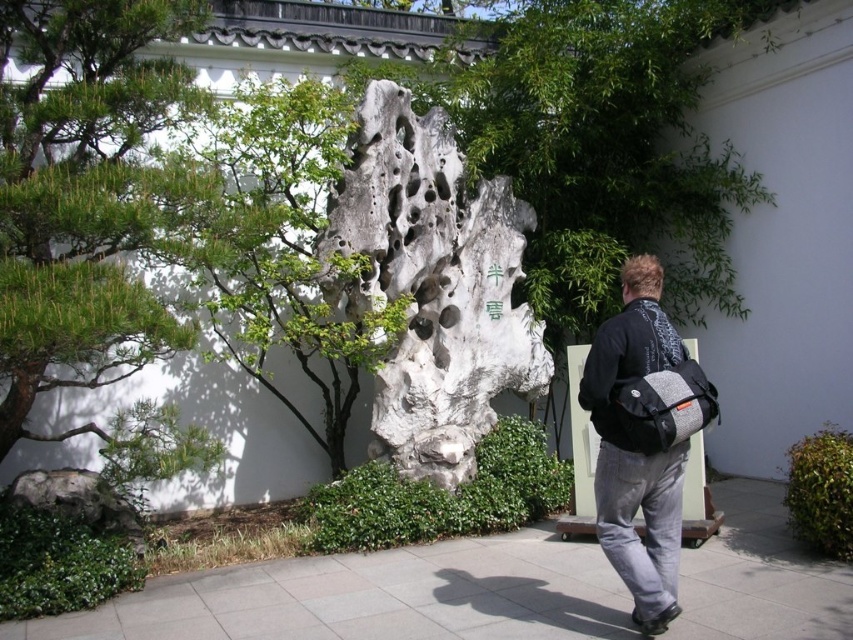
Can you confirm if white stone sculpture at center is shorter than dark gray fabric backpack at center right?

No, white stone sculpture at center is not shorter than dark gray fabric backpack at center right.

Measure the distance between white stone sculpture at center and camera.

white stone sculpture at center and camera are 6.53 meters apart from each other.

Describe the element at coordinates (434, 285) in the screenshot. I see `white stone sculpture at center` at that location.

Find the location of a particular element. This screenshot has width=853, height=640. white stone sculpture at center is located at coordinates (434, 285).

Locate an element on the screen. The width and height of the screenshot is (853, 640). white porous rock at center is located at coordinates (599, 147).

Between point (689, 244) and point (698, 566), which one is positioned in front?

Point (698, 566) is in front.

Where is `white porous rock at center`? white porous rock at center is located at coordinates (599, 147).

At what (x,y) coordinates should I click in order to perform the action: click on white porous rock at center. Please return your answer as a coordinate pair (x, y). This screenshot has width=853, height=640. Looking at the image, I should click on (599, 147).

What do you see at coordinates (599, 147) in the screenshot?
I see `white porous rock at center` at bounding box center [599, 147].

Which is in front, point (706, 12) or point (450, 275)?

Point (450, 275)

Which is behind, point (532, 45) or point (422, 371)?

The point (532, 45) is more distant.

You are a GUI agent. You are given a task and a screenshot of the screen. Output one action in this format:
    pyautogui.click(x=<x>, y=<y>)
    Task: Click on the white porous rock at center
    The width and height of the screenshot is (853, 640).
    Given the screenshot: What is the action you would take?
    pyautogui.click(x=599, y=147)